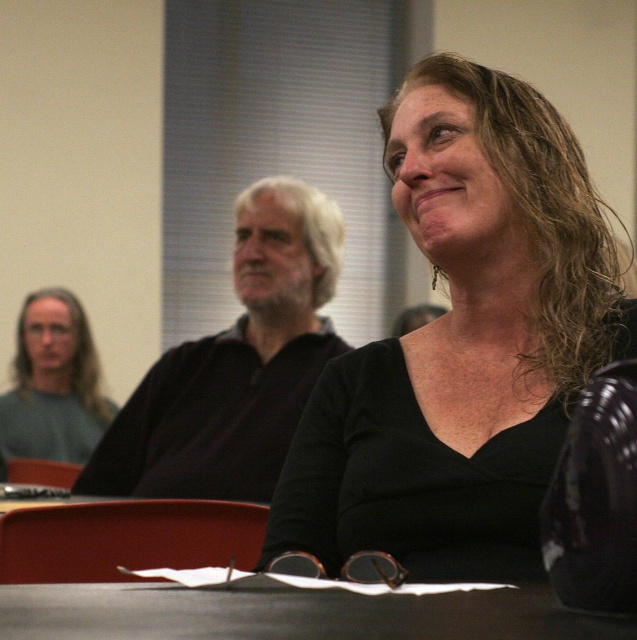
Question: Which object appears closest to the camera in this image?

Choices:
 (A) wavy brown hair at upper right
 (B) smooth black table at center
 (C) black matte shirt at center
 (D) white matte hair at center

Answer: (B)

Question: Which point is farther from the camera taking this photo?

Choices:
 (A) (366, 500)
 (B) (39, 620)

Answer: (A)

Question: Which point is farther from the camera taking this photo?

Choices:
 (A) (461, 113)
 (B) (245, 392)
 (C) (541, 180)

Answer: (B)

Question: Does dark brown shirt at center appear over white matte hair at center?

Choices:
 (A) no
 (B) yes

Answer: (A)

Question: Does dark brown shirt at center have a larger size compared to smooth black table at center?

Choices:
 (A) yes
 (B) no

Answer: (A)

Question: Does wavy brown hair at upper right appear over smooth black table at center?

Choices:
 (A) no
 (B) yes

Answer: (B)